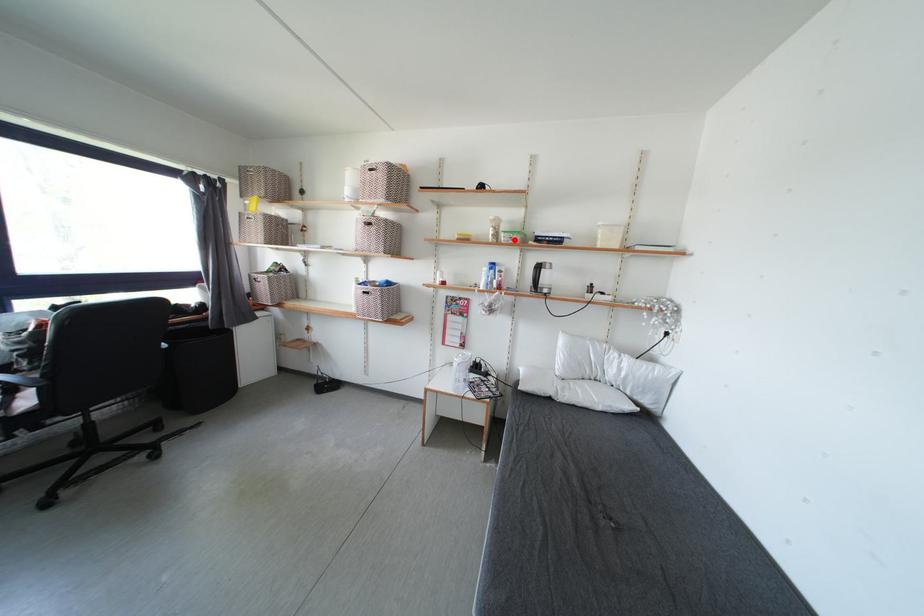
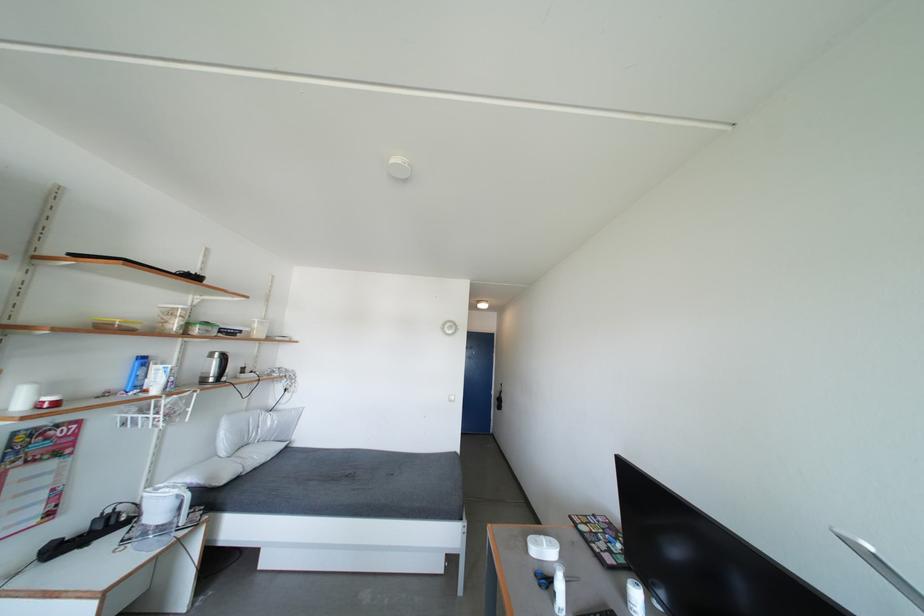
Locate, in the second image, the point that corresponds to the highlighted location in the first image.

(212, 333)